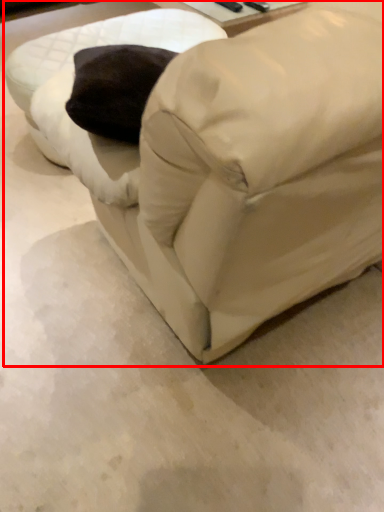
Question: From the image's perspective, what is the correct spatial relationship of furniture (annotated by the red box) in relation to swivel chair?

Choices:
 (A) above
 (B) below

Answer: (B)